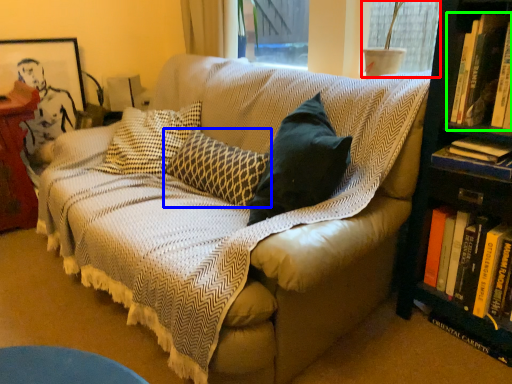
Question: Which object is positioned closest to window screen (highlighted by a red box)? Select from pillow (highlighted by a blue box) and book (highlighted by a green box).

Choices:
 (A) pillow
 (B) book

Answer: (B)